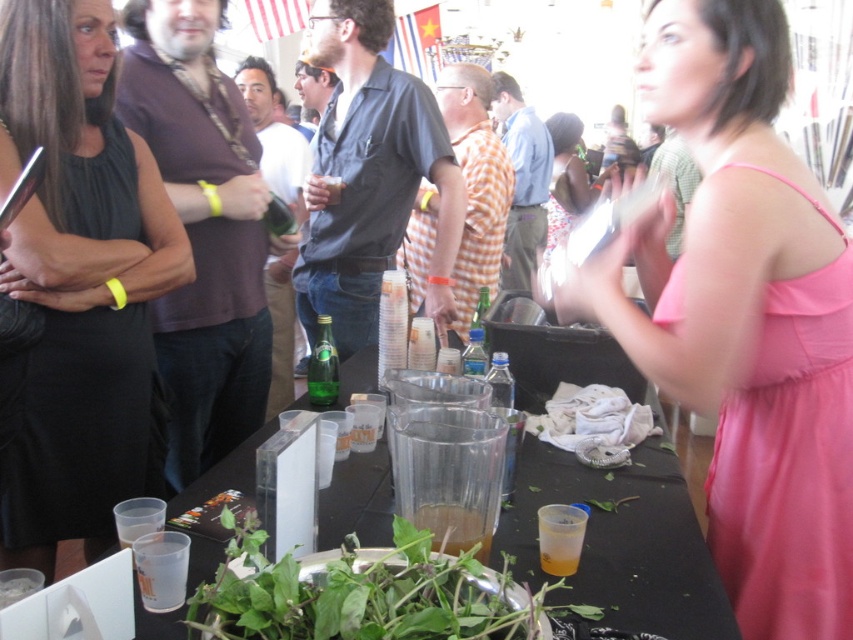
In the scene shown: You are at a party and want to find the pink satin dress at right. Where should you look in relation to the green leafy vegetable at center?

The pink satin dress at right is above the green leafy vegetable at center, so you should look upwards from the green leafy vegetable at center to find it.

You are at a party and need to grab a drink quickly. You see a translucent plastic cup at center and a green glass bottle at center on the table. If you reach for the cup first, will you have to stretch your arm more than 1 meter to also grab the bottle?

The translucent plastic cup at center is 84.64 centimeters away from the green glass bottle at center. Since 84.64 cm is less than 1 meter, you won not have to stretch your arm more than 1 meter to grab the bottle after the cup.